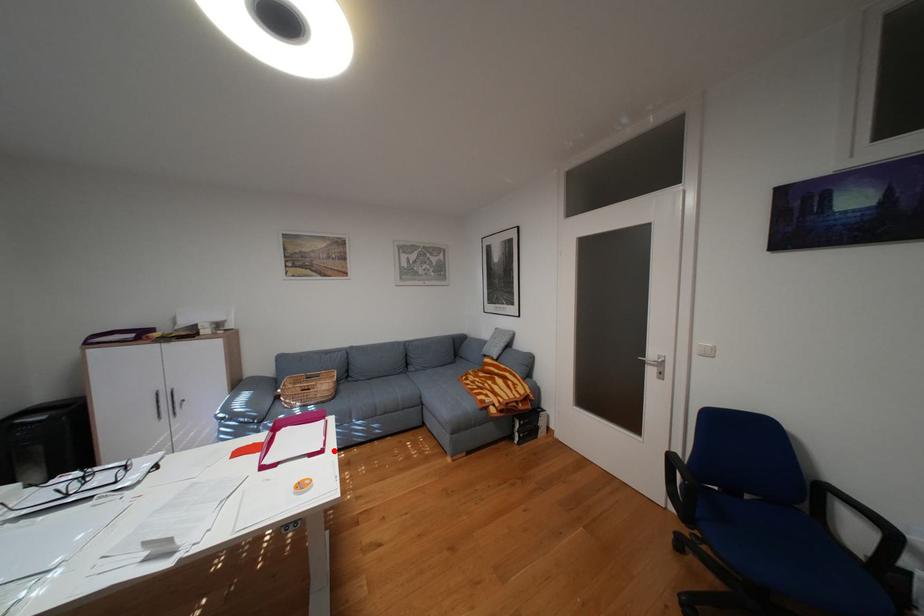
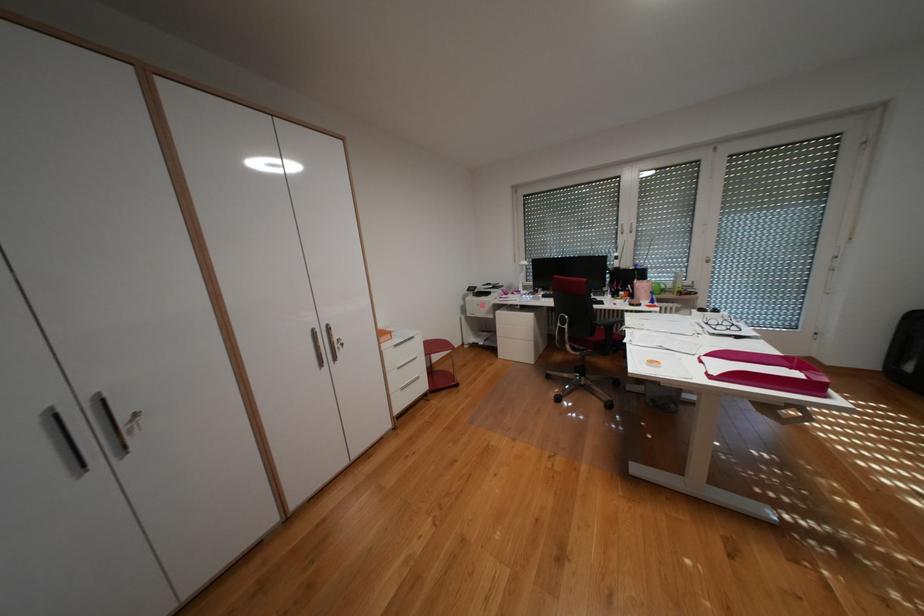
Locate, in the second image, the point that corresponds to the highlighted location in the first image.

(723, 377)